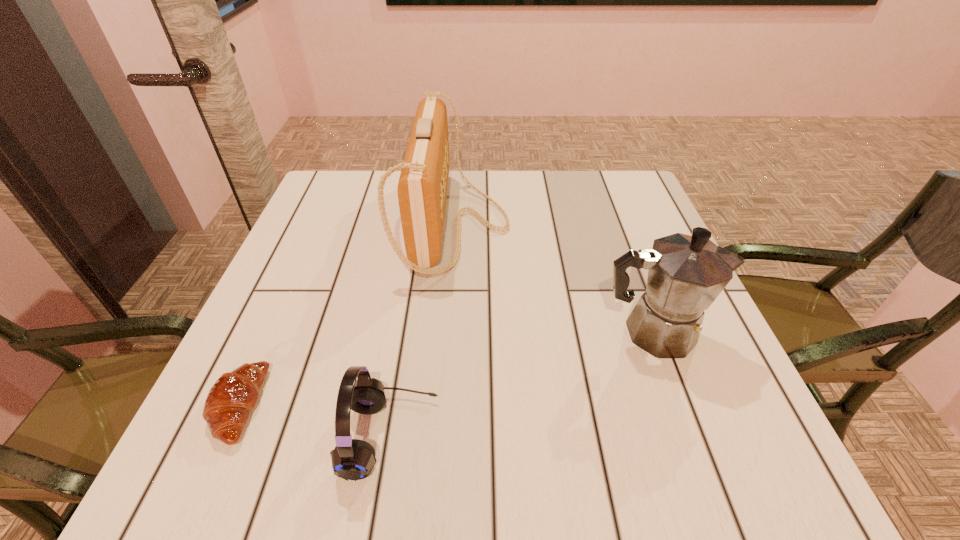
Identify the location of vacant area that lies between the rightmost object and the headset. (521, 384).

The height and width of the screenshot is (540, 960). I want to click on object that is the third nearest to the headset, so click(686, 274).

What are the coordinates of `the closest object to the third tallest object` in the screenshot? It's located at (233, 396).